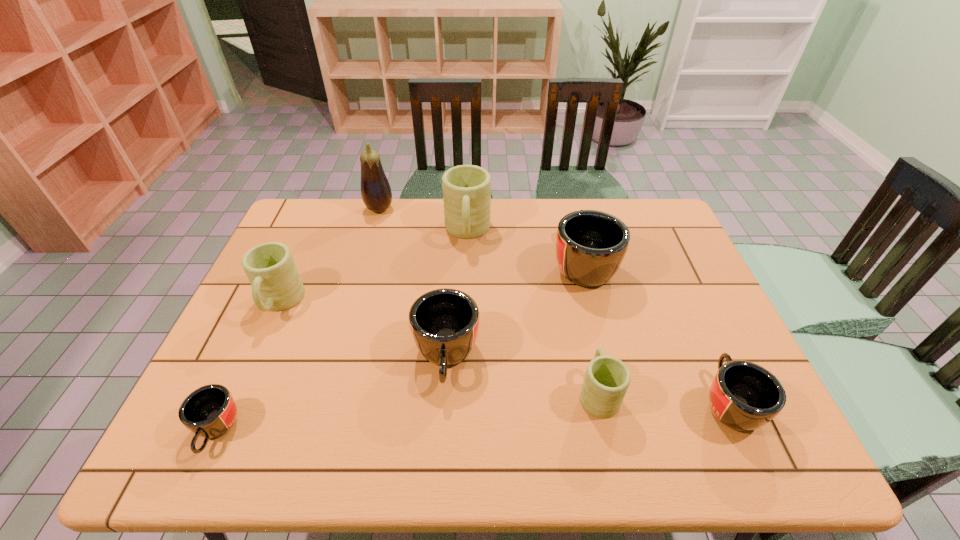
Find the location of `the rightmost green mug`. the rightmost green mug is located at coordinates (606, 381).

You are a GUI agent. You are given a task and a screenshot of the screen. Output one action in this format:
    pyautogui.click(x=<x>, y=<y>)
    Task: Click on the rightmost red mug
    This screenshot has width=960, height=540.
    Given the screenshot: What is the action you would take?
    pyautogui.click(x=744, y=396)

At what (x,y) coordinates should I click in order to perform the action: click on the rightmost mug. Please return your answer as a coordinate pair (x, y). Looking at the image, I should click on click(744, 396).

Find the location of a particular element. The width and height of the screenshot is (960, 540). the leftmost red mug is located at coordinates (210, 411).

You are a GUI agent. You are given a task and a screenshot of the screen. Output one action in this format:
    pyautogui.click(x=<x>, y=<y>)
    Task: Click on the smallest red mug
    The width and height of the screenshot is (960, 540).
    Given the screenshot: What is the action you would take?
    pyautogui.click(x=210, y=411)

Find the location of `vacant space located on the front of the sixth object from right to left`. vacant space located on the front of the sixth object from right to left is located at coordinates (364, 262).

Locate an element on the screen. Image resolution: width=960 pixels, height=540 pixels. vacant space positioned 0.360m on the side of the second green mug from right to left with the handle is located at coordinates (464, 347).

Locate an element on the screen. The width and height of the screenshot is (960, 540). free space located on the side of the farthest red mug with the handle is located at coordinates (568, 206).

Locate an element on the screen. free space located on the side of the farthest red mug with the handle is located at coordinates (570, 215).

Identify the location of vacant space located 0.170m on the side of the farthest red mug with the handle. Image resolution: width=960 pixels, height=540 pixels. (568, 206).